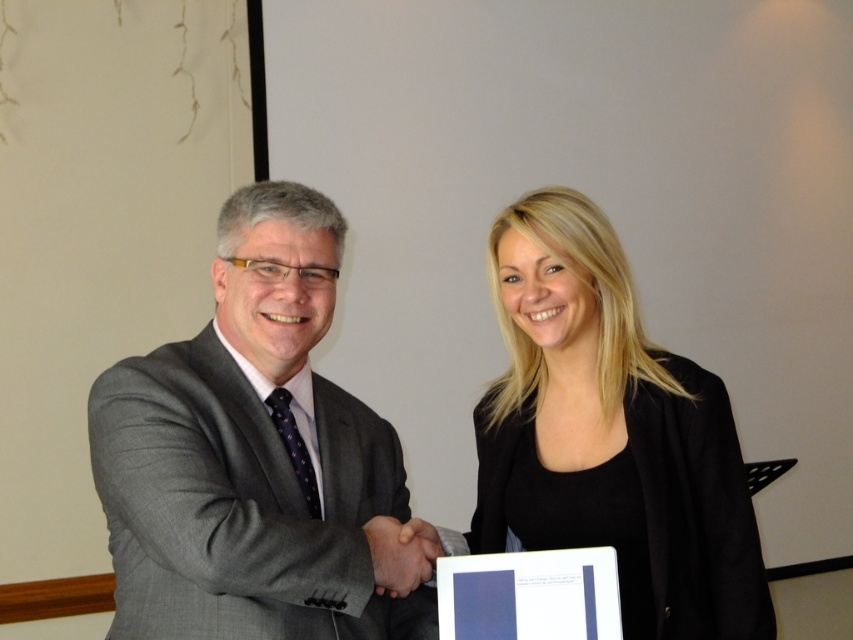
Question: Does black matte jacket at center lie behind smooth skin handshake at center?

Choices:
 (A) yes
 (B) no

Answer: (A)

Question: Which of the following is the closest to the observer?

Choices:
 (A) (592, 328)
 (B) (142, 428)
 (C) (386, 524)

Answer: (B)

Question: Which point is farther to the camera?

Choices:
 (A) tap(372, 557)
 (B) tap(606, 500)
 (C) tap(384, 468)

Answer: (C)

Question: Is black matte jacket at center to the right of smooth skin handshake at center from the viewer's perspective?

Choices:
 (A) no
 (B) yes

Answer: (B)

Question: Is gray suit at center above black matte jacket at center?

Choices:
 (A) no
 (B) yes

Answer: (B)

Question: Estimate the real-world distances between objects in this image. Which object is farther from the smooth skin handshake at center?

Choices:
 (A) black matte jacket at center
 (B) gray suit at center

Answer: (A)